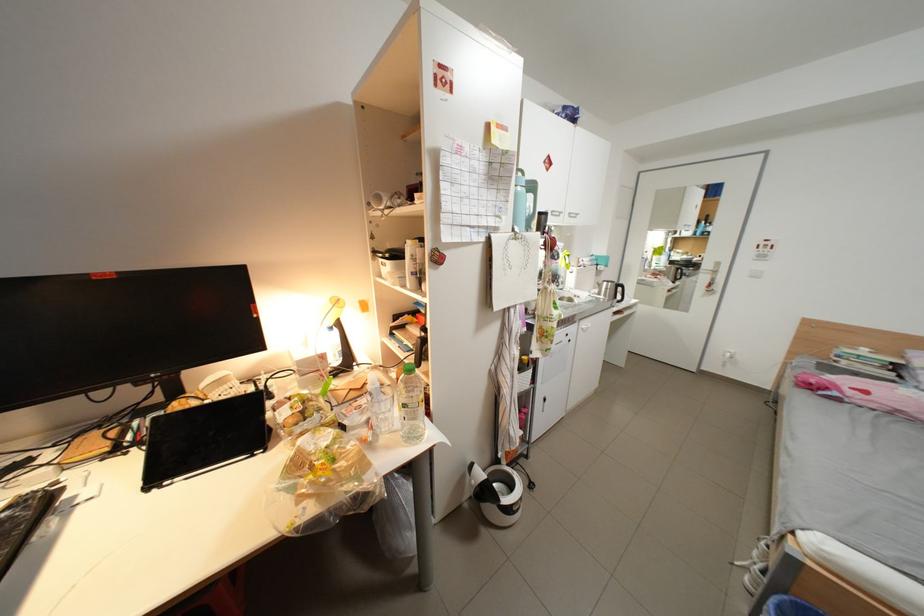
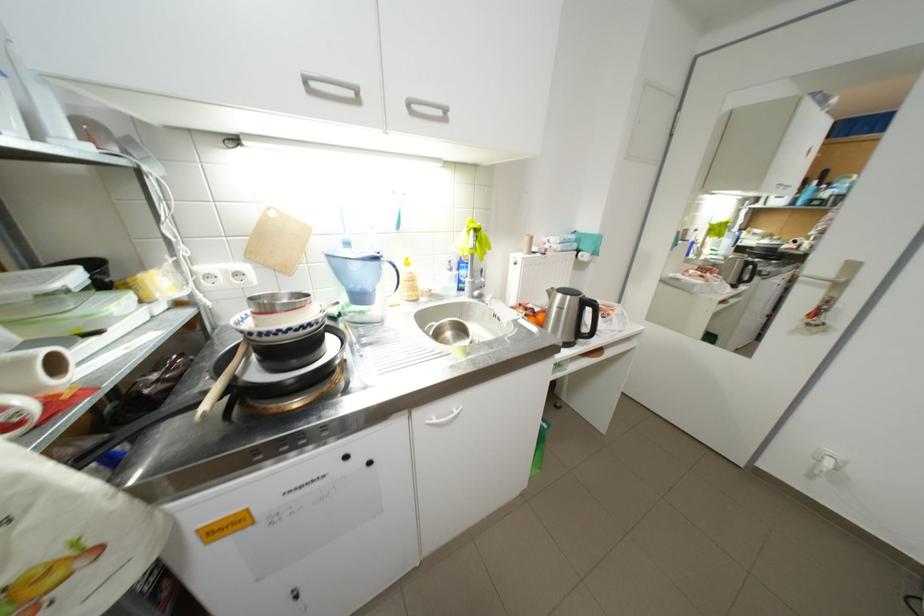
What movement of the cameraman would produce the second image?

The cameraman moved toward right, forward.